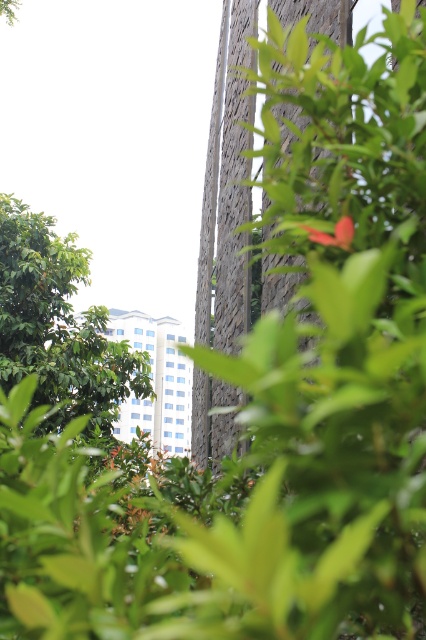
What are the coordinates of `green leafy tree at lower left` in the screenshot? It's located at (57, 324).

Which of these two, green leafy tree at lower left or matte red flower at center, stands taller?

Standing taller between the two is green leafy tree at lower left.

Identify the location of green leafy tree at lower left. (57, 324).